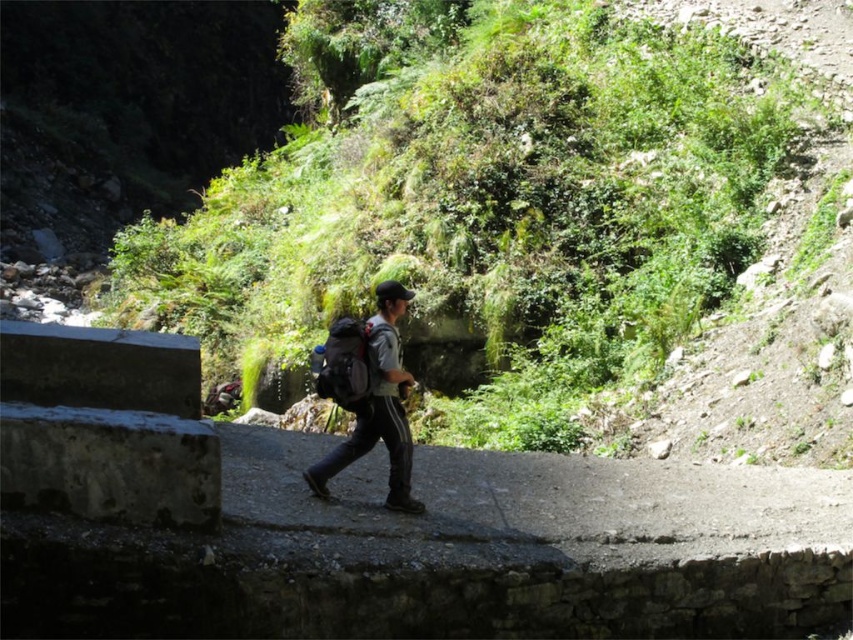
You are a hiker who wants to take a photo of the green leafy vegetation at center and the matte gray backpack at center. Which object is higher in the image?

The green leafy vegetation at center is located above the matte gray backpack at center, so it is higher in the image.

You are a hiker who just started walking on the path. You need to check your backpack. Where should you look to find the gray fabric backpack at center?

The gray fabric backpack at center is located at point (x=369, y=396), so you should look there to find it.

You are a hiker trying to navigate a narrow path on a steep hillside. You see the green leafy vegetation at center and the matte gray backpack at center. Which object is positioned to the right of the other?

The green leafy vegetation at center is to the right of the matte gray backpack at center.